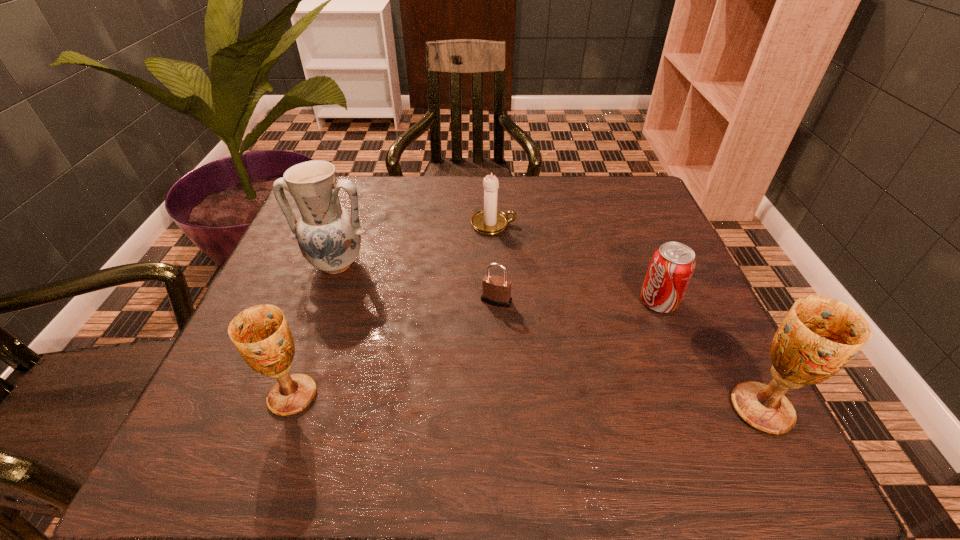
Where is `object that is at the near right corner`? Image resolution: width=960 pixels, height=540 pixels. object that is at the near right corner is located at coordinates (819, 335).

I want to click on vacant space at the far edge, so click(421, 207).

The height and width of the screenshot is (540, 960). In the image, there is a desktop. Find the location of `vacant space at the near edge`. vacant space at the near edge is located at coordinates (481, 389).

You are a GUI agent. You are given a task and a screenshot of the screen. Output one action in this format:
    pyautogui.click(x=<x>, y=<y>)
    Task: Click on the vacant space at the left edge
    The width and height of the screenshot is (960, 540).
    Given the screenshot: What is the action you would take?
    pyautogui.click(x=270, y=276)

I want to click on vacant space at the right edge of the desktop, so click(x=614, y=228).

In the image, there is a desktop. Identify the location of vacant space at the far right corner. (646, 214).

Image resolution: width=960 pixels, height=540 pixels. I want to click on blank region between the left chalice and the pottery, so click(x=314, y=330).

Locate an element on the screen. This screenshot has height=540, width=960. free space between the rightmost object and the pottery is located at coordinates (549, 336).

This screenshot has width=960, height=540. Identify the location of vacant point located between the second object from right to left and the taller chalice. (710, 355).

The height and width of the screenshot is (540, 960). I want to click on vacant area between the soda and the left chalice, so click(475, 349).